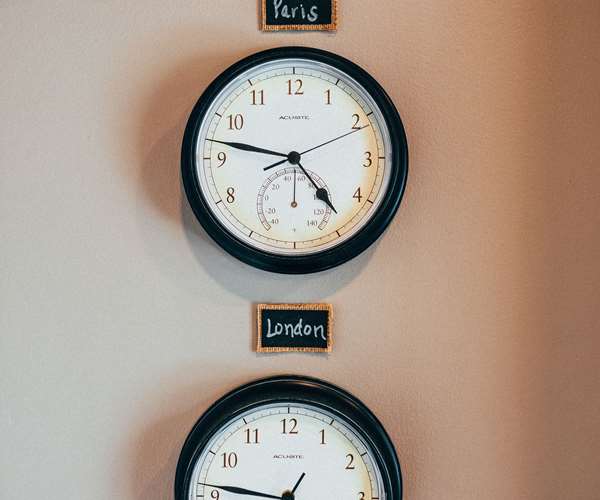
You are a GUI agent. You are given a task and a screenshot of the screen. Output one action in this format:
    pyautogui.click(x=<x>, y=<y>)
    Task: Click on the clock face
    
    Given the screenshot: What is the action you would take?
    pyautogui.click(x=291, y=132), pyautogui.click(x=279, y=473)